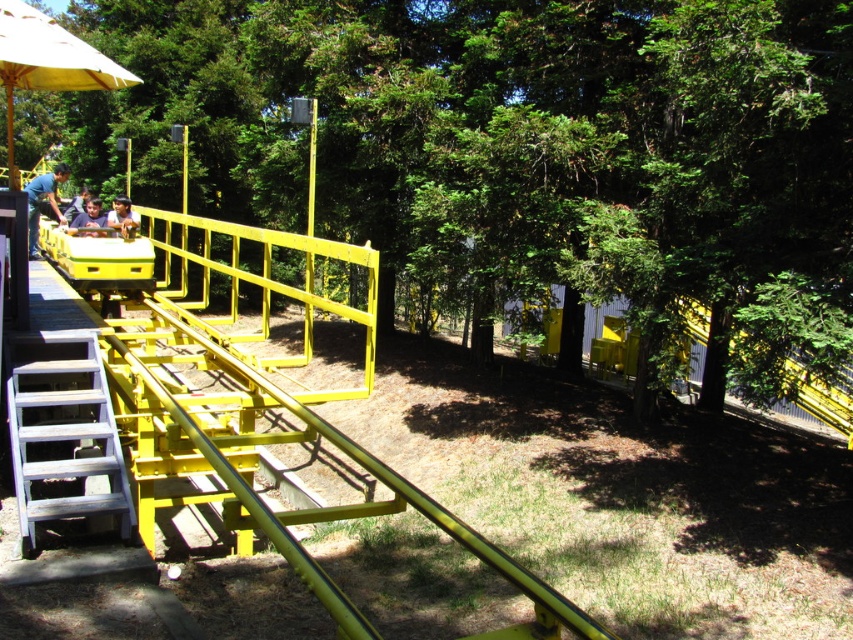
Locate an element on the screen. matte blue shirt at left is located at coordinates (42, 202).

Does matte blue shirt at left appear on the left side of matte yellow shirt at left?

Correct, you'll find matte blue shirt at left to the left of matte yellow shirt at left.

I want to click on matte blue shirt at left, so click(x=42, y=202).

What do you see at coordinates (90, 220) in the screenshot?
I see `matte black shirt at left` at bounding box center [90, 220].

Is the position of matte black shirt at left less distant than that of matte yellow shirt at left?

Yes, it is in front of matte yellow shirt at left.

Between point (68, 221) and point (82, 198), which one is positioned behind?

The point (82, 198) is behind.

You are a GUI agent. You are given a task and a screenshot of the screen. Output one action in this format:
    pyautogui.click(x=<x>, y=<y>)
    Task: Click on the matte black shirt at left
    
    Given the screenshot: What is the action you would take?
    pyautogui.click(x=90, y=220)

Can you confirm if wooden stairs at lower left is positioned above matte blue shirt at left?

Actually, wooden stairs at lower left is below matte blue shirt at left.

Does wooden stairs at lower left appear on the right side of matte blue shirt at left?

Yes, wooden stairs at lower left is to the right of matte blue shirt at left.

You are a GUI agent. You are given a task and a screenshot of the screen. Output one action in this format:
    pyautogui.click(x=<x>, y=<y>)
    Task: Click on the wooden stairs at lower left
    The height and width of the screenshot is (640, 853).
    Given the screenshot: What is the action you would take?
    point(62,429)

Locate an element on the screen. wooden stairs at lower left is located at coordinates coord(62,429).